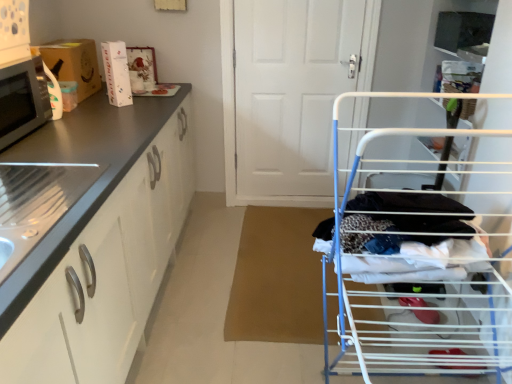
Question: Can you confirm if brushed metal drawer at left is taller than white glossy cabinet at left?

Choices:
 (A) yes
 (B) no

Answer: (B)

Question: Is brushed metal drawer at left smaller than white glossy cabinet at left?

Choices:
 (A) yes
 (B) no

Answer: (A)

Question: Can you confirm if brushed metal drawer at left is bigger than white glossy cabinet at left?

Choices:
 (A) yes
 (B) no

Answer: (B)

Question: Would you say brushed metal drawer at left is a long distance from white glossy cabinet at left?

Choices:
 (A) yes
 (B) no

Answer: (B)

Question: From the image's perspective, would you say brushed metal drawer at left is positioned over white glossy cabinet at left?

Choices:
 (A) yes
 (B) no

Answer: (A)

Question: In the image, is white wire drying rack at right positioned in front of or behind white glossy cabinet at left?

Choices:
 (A) behind
 (B) front

Answer: (A)

Question: Considering the positions of white wire drying rack at right and white glossy cabinet at left in the image, is white wire drying rack at right wider or thinner than white glossy cabinet at left?

Choices:
 (A) wide
 (B) thin

Answer: (B)

Question: Considering the positions of white wire drying rack at right and white glossy cabinet at left in the image, is white wire drying rack at right taller or shorter than white glossy cabinet at left?

Choices:
 (A) tall
 (B) short

Answer: (A)

Question: Would you say white wire drying rack at right is to the left or to the right of white glossy cabinet at left in the picture?

Choices:
 (A) left
 (B) right

Answer: (B)

Question: Is matte black microwave at left inside or outside of matte cardboard box at left?

Choices:
 (A) outside
 (B) inside

Answer: (A)

Question: Is point (10, 87) positioned closer to the camera than point (93, 59)?

Choices:
 (A) closer
 (B) farther

Answer: (A)

Question: In the image, is matte black microwave at left on the left side or the right side of matte cardboard box at left?

Choices:
 (A) left
 (B) right

Answer: (B)

Question: From the image's perspective, relative to matte cardboard box at left, is matte black microwave at left above or below?

Choices:
 (A) below
 (B) above

Answer: (A)

Question: Would you say white glossy cabinet at left is inside or outside white wire drying rack at right?

Choices:
 (A) inside
 (B) outside

Answer: (B)

Question: Based on their sizes in the image, would you say white glossy cabinet at left is bigger or smaller than white wire drying rack at right?

Choices:
 (A) big
 (B) small

Answer: (A)